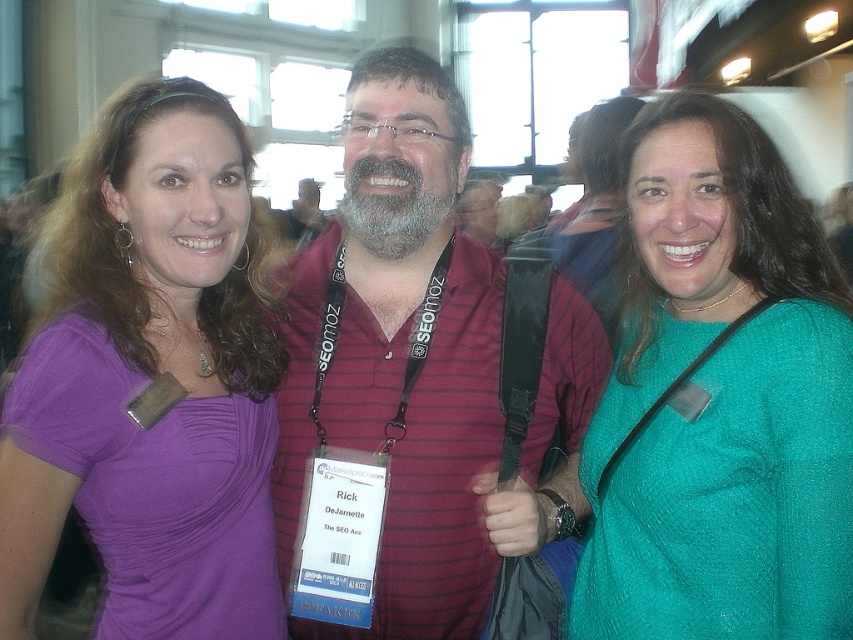
Question: Can you confirm if matte purple shirt at left is positioned above graybeard at center?

Choices:
 (A) no
 (B) yes

Answer: (B)

Question: Among these objects, which one is nearest to the camera?

Choices:
 (A) graybeard at center
 (B) matte purple shirt at left
 (C) maroon striped shirt at center

Answer: (B)

Question: Which object is closer to the camera taking this photo?

Choices:
 (A) maroon striped shirt at center
 (B) teal textured sweater at center
 (C) graybeard at center
 (D) matte purple shirt at left

Answer: (B)

Question: In this image, where is teal textured sweater at center located relative to graybeard at center?

Choices:
 (A) left
 (B) right

Answer: (B)

Question: Which object is closer to the camera taking this photo?

Choices:
 (A) graybeard at center
 (B) matte purple shirt at left

Answer: (B)

Question: Does teal textured sweater at center come behind graybeard at center?

Choices:
 (A) yes
 (B) no

Answer: (B)